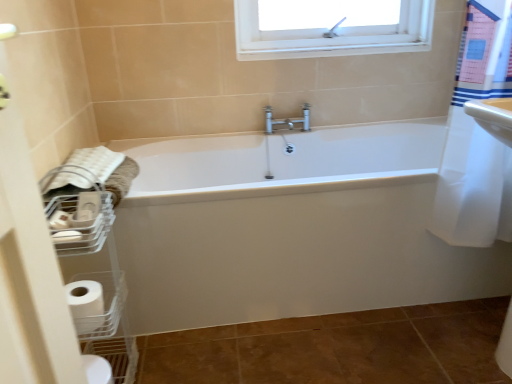
Question: Is white plastic basket at lower left a part of white soft towel at left?

Choices:
 (A) yes
 (B) no

Answer: (B)

Question: Is white soft towel at left shorter than white plastic basket at lower left?

Choices:
 (A) no
 (B) yes

Answer: (B)

Question: Would you consider white soft towel at left to be distant from white plastic basket at lower left?

Choices:
 (A) no
 (B) yes

Answer: (A)

Question: Is white soft towel at left positioned in front of white plastic basket at lower left?

Choices:
 (A) yes
 (B) no

Answer: (B)

Question: Is white soft towel at left bigger than white plastic basket at lower left?

Choices:
 (A) yes
 (B) no

Answer: (B)

Question: Based on their positions, is white soft towel at left located to the left or right of white plastic basket at lower left?

Choices:
 (A) right
 (B) left

Answer: (B)

Question: Considering the positions of white soft towel at left and white plastic basket at lower left in the image, is white soft towel at left wider or thinner than white plastic basket at lower left?

Choices:
 (A) thin
 (B) wide

Answer: (B)

Question: Is white soft towel at left situated inside white plastic basket at lower left or outside?

Choices:
 (A) inside
 (B) outside

Answer: (B)

Question: From a real-world perspective, is white soft towel at left above or below white plastic basket at lower left?

Choices:
 (A) above
 (B) below

Answer: (A)

Question: In terms of height, does white plastic basket at lower left look taller or shorter compared to brown matte ceramic tile at lower center?

Choices:
 (A) short
 (B) tall

Answer: (B)

Question: Does point (90, 274) appear closer or farther from the camera than point (492, 301)?

Choices:
 (A) farther
 (B) closer

Answer: (B)

Question: Is white plastic basket at lower left in front of or behind brown matte ceramic tile at lower center in the image?

Choices:
 (A) behind
 (B) front

Answer: (B)

Question: In terms of width, does white plastic basket at lower left look wider or thinner when compared to brown matte ceramic tile at lower center?

Choices:
 (A) wide
 (B) thin

Answer: (B)

Question: Considering the relative positions of white matte toilet paper at lower left and white plastic basket at lower left in the image provided, is white matte toilet paper at lower left to the left or to the right of white plastic basket at lower left?

Choices:
 (A) left
 (B) right

Answer: (B)

Question: From a real-world perspective, relative to white plastic basket at lower left, is white matte toilet paper at lower left vertically above or below?

Choices:
 (A) above
 (B) below

Answer: (B)